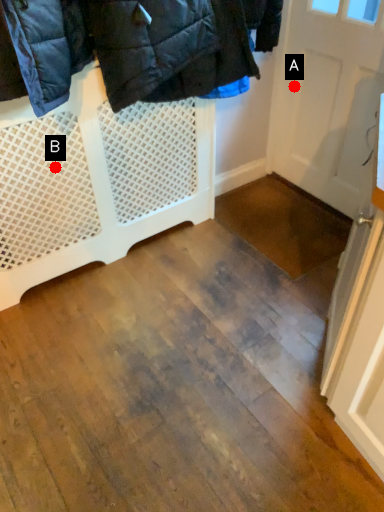
Question: Two points are circled on the image, labeled by A and B beside each circle. Which point is closer to the camera taking this photo?

Choices:
 (A) A is closer
 (B) B is closer

Answer: (B)